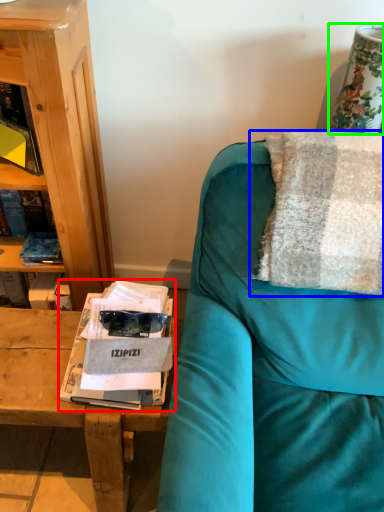
Question: Considering the real-world distances, which object is farthest from magazine (highlighted by a red box)? pillow (highlighted by a blue box) or table lamp (highlighted by a green box)?

Choices:
 (A) pillow
 (B) table lamp

Answer: (B)